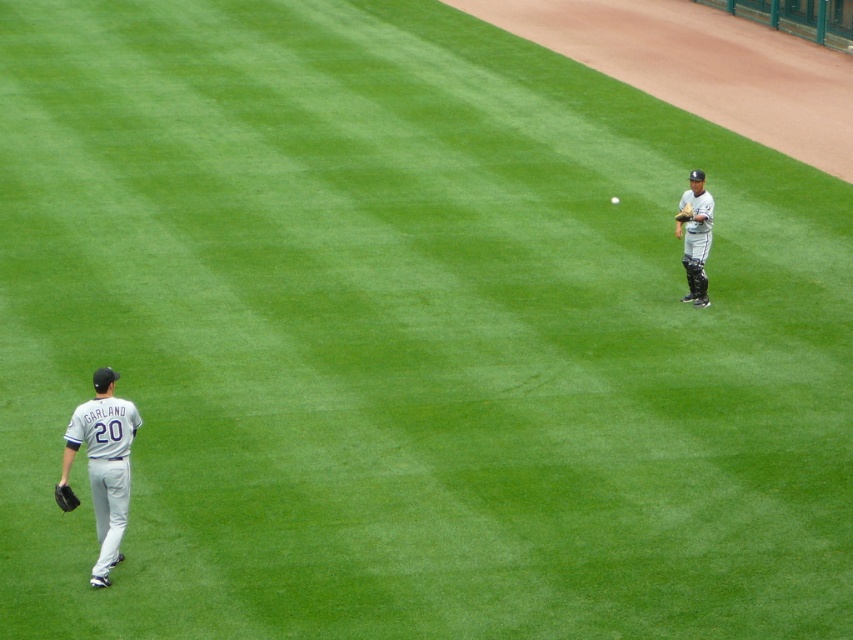
You are a coach observing the baseball game. You notice the dark gray matte baseball glove at lower left and the white matte baseball at center. How far apart are these two items in meters?

The dark gray matte baseball glove at lower left and the white matte baseball at center are 12.58 meters apart from each other.

You are a spectator at the baseball game. You want to know if the dark gray matte baseball glove at lower left is in front of or behind the gray uniformed catcher at upper right. Can you tell me based on the scene?

The dark gray matte baseball glove at lower left is behind the gray uniformed catcher at upper right.

You are a photographer standing at the center of the baseball field. You want to take a photo of the gray uniformed catcher at upper right. According to the coordinates provided, where should you aim your camera to capture this player?

To capture the gray uniformed catcher at upper right, aim your camera at the coordinates point (695, 236).